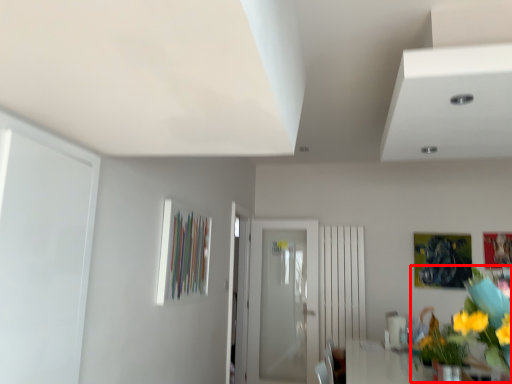
Question: Observing the image, what is the correct spatial positioning of floral arrangement (annotated by the red box) in reference to door?

Choices:
 (A) right
 (B) left

Answer: (A)